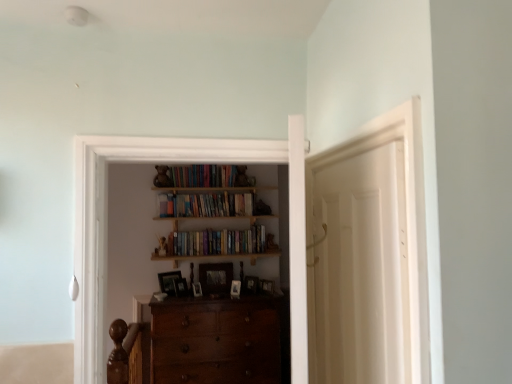
Describe the element at coordinates (267, 286) in the screenshot. The height and width of the screenshot is (384, 512). I see `wooden picture frame at center, acting as the 7th picture frame starting from the left` at that location.

In order to face wooden picture frame at center, which ranks as the first picture frame in right-to-left order, should I rotate leftwards or rightwards?

You should rotate right by 1.749 degrees.

Where is `wooden photo frame at center, the 7th picture frame from the right`? wooden photo frame at center, the 7th picture frame from the right is located at coordinates (169, 281).

This screenshot has height=384, width=512. Describe the element at coordinates (216, 278) in the screenshot. I see `wooden picture frame at center, which is counted as the fourth picture frame, starting from the right` at that location.

Measure the distance between point [239,288] and camera.

A distance of 3.75 meters exists between point [239,288] and camera.

The image size is (512, 384). Describe the element at coordinates (234, 289) in the screenshot. I see `wooden picture frame at center, the 3th picture frame positioned from the right` at that location.

The image size is (512, 384). I want to click on brown polished wood chair at lower left, so click(129, 353).

From the image's perspective, who appears lower, white matte door at center or brown polished wood chair at lower left?

brown polished wood chair at lower left, from the image's perspective.

Is white matte door at center smaller than brown polished wood chair at lower left?

Indeed, white matte door at center has a smaller size compared to brown polished wood chair at lower left.

In terms of width, does white matte door at center look wider or thinner when compared to brown polished wood chair at lower left?

white matte door at center is thinner than brown polished wood chair at lower left.

Which is less distant, (415, 252) or (138, 380)?

The point (415, 252) is in front.

Considering the positions of objects brown polished wood chair at lower left and wooden photo frame at center, placed as the second picture frame when sorted from left to right, in the image provided, who is more to the left, brown polished wood chair at lower left or wooden photo frame at center, placed as the second picture frame when sorted from left to right,?

brown polished wood chair at lower left is more to the left.

Which object is further away from the camera taking this photo, brown polished wood chair at lower left or wooden photo frame at center, placed as the sixth picture frame when sorted from right to left?

wooden photo frame at center, placed as the sixth picture frame when sorted from right to left, is more distant.

Considering the relative sizes of brown polished wood chair at lower left and wooden photo frame at center, placed as the sixth picture frame when sorted from right to left, in the image provided, is brown polished wood chair at lower left wider than wooden photo frame at center, placed as the sixth picture frame when sorted from right to left,?

Correct, the width of brown polished wood chair at lower left exceeds that of wooden photo frame at center, placed as the sixth picture frame when sorted from right to left.

Can you see wooden photo frame at center, which is the first picture frame in left-to-right order, touching wooden picture frame at center, which is counted as the sixth picture frame, starting from the left?

wooden photo frame at center, which is the first picture frame in left-to-right order, is not next to wooden picture frame at center, which is counted as the sixth picture frame, starting from the left, and they're not touching.

From the picture: Is wooden photo frame at center, the 7th picture frame from the right, bigger than wooden picture frame at center, the second picture frame positioned from the right?

Correct, wooden photo frame at center, the 7th picture frame from the right, is larger in size than wooden picture frame at center, the second picture frame positioned from the right.

Looking at this image, is wooden photo frame at center, which is the first picture frame in left-to-right order, shorter than wooden picture frame at center, the second picture frame positioned from the right?

No, wooden photo frame at center, which is the first picture frame in left-to-right order, is not shorter than wooden picture frame at center, the second picture frame positioned from the right.

Is wooden bookshelf at upper center, the first book from the top, oriented away from wooden photo frame at center, the third picture frame when ordered from left to right?

No, wooden photo frame at center, the third picture frame when ordered from left to right, is not at the back of wooden bookshelf at upper center, the first book from the top.

Considering the relative positions of wooden bookshelf at upper center, the first book from the top, and wooden photo frame at center, the third picture frame when ordered from left to right, in the image provided, is wooden bookshelf at upper center, the first book from the top, in front of wooden photo frame at center, the third picture frame when ordered from left to right,?

No, wooden bookshelf at upper center, the first book from the top, is further to the viewer.

Considering the sizes of objects wooden bookshelf at upper center, acting as the second book starting from the bottom, and wooden photo frame at center, the third picture frame when ordered from left to right, in the image provided, who is bigger, wooden bookshelf at upper center, acting as the second book starting from the bottom, or wooden photo frame at center, the third picture frame when ordered from left to right,?

wooden bookshelf at upper center, acting as the second book starting from the bottom.

From the image's perspective, between wooden bookshelf at upper center, acting as the second book starting from the bottom, and wooden photo frame at center, arranged as the fifth picture frame when viewed from the right, which one is located above?

wooden bookshelf at upper center, acting as the second book starting from the bottom, is shown above in the image.

Which point is more distant from viewer, (x=144, y=378) or (x=217, y=336)?

The point (x=144, y=378) is behind.

Is the position of brown polished wood chair at lower left less distant than that of shiny brown wooden chest of drawers at center?

Yes, it is in front of shiny brown wooden chest of drawers at center.

Does brown polished wood chair at lower left have a greater width compared to shiny brown wooden chest of drawers at center?

Incorrect, the width of brown polished wood chair at lower left does not surpass that of shiny brown wooden chest of drawers at center.

Is brown polished wood chair at lower left to the right of shiny brown wooden chest of drawers at center from the viewer's perspective?

No.

Is wooden picture frame at center, the second picture frame positioned from the right, oriented towards woodenmaterial/texture entertainment center at center?

No, wooden picture frame at center, the second picture frame positioned from the right, is not turned towards woodenmaterial/texture entertainment center at center.

Is the depth of wooden picture frame at center, which is counted as the sixth picture frame, starting from the left, greater than that of woodenmaterial/texture entertainment center at center?

Yes, it is behind woodenmaterial/texture entertainment center at center.

From the image's perspective, is wooden picture frame at center, which is counted as the sixth picture frame, starting from the left, located above or below woodenmaterial/texture entertainment center at center?

Clearly, from the image's perspective, wooden picture frame at center, which is counted as the sixth picture frame, starting from the left, is below woodenmaterial/texture entertainment center at center.

Considering the relative sizes of wooden picture frame at center, the second picture frame positioned from the right, and woodenmaterial/texture entertainment center at center in the image provided, is wooden picture frame at center, the second picture frame positioned from the right, thinner than woodenmaterial/texture entertainment center at center?

Yes, wooden picture frame at center, the second picture frame positioned from the right, is thinner than woodenmaterial/texture entertainment center at center.

Is shiny brown wooden chest of drawers at center aimed at hardcover books at center, which is the first book in bottom-to-top order?

No, shiny brown wooden chest of drawers at center is not aimed at hardcover books at center, which is the first book in bottom-to-top order.

Is shiny brown wooden chest of drawers at center located outside hardcover books at center, which is the first book in bottom-to-top order?

Yes, shiny brown wooden chest of drawers at center is located beyond the bounds of hardcover books at center, which is the first book in bottom-to-top order.

Is the position of shiny brown wooden chest of drawers at center less distant than that of hardcover books at center, which is counted as the second book, starting from the top?

Yes, shiny brown wooden chest of drawers at center is closer to the camera.

In the image, there is a white matte door at center. Where is `chair below it (from a real-world perspective)`? The height and width of the screenshot is (384, 512). chair below it (from a real-world perspective) is located at coordinates (129, 353).

Where is `the 2nd picture frame to the right of the brown polished wood chair at lower left, counting from the anchor's position`? the 2nd picture frame to the right of the brown polished wood chair at lower left, counting from the anchor's position is located at coordinates (180, 287).

Looking at the image, which one is located further to brown polished wood chair at lower left, wooden picture frame at center, marked as the fifth picture frame in a left-to-right arrangement, or wooden picture frame at center, the second picture frame positioned from the right?

wooden picture frame at center, the second picture frame positioned from the right, is positioned further to the anchor brown polished wood chair at lower left.

When comparing their distances from wooden photo frame at center, the third picture frame when ordered from left to right, does wooden picture frame at center, which is counted as the fourth picture frame, starting from the right, or wooden photo frame at center, placed as the second picture frame when sorted from left to right, seem closer?

wooden photo frame at center, placed as the second picture frame when sorted from left to right, is positioned closer to the anchor wooden photo frame at center, the third picture frame when ordered from left to right.

Looking at the image, which one is located closer to hardcover books at center, which is counted as the second book, starting from the top, white matte door at center or woodenmaterial/texture entertainment center at center?

The object closer to hardcover books at center, which is counted as the second book, starting from the top, is woodenmaterial/texture entertainment center at center.

From the image, which object appears to be farther from wooden photo frame at center, placed as the second picture frame when sorted from left to right, wooden picture frame at center, which ranks as the first picture frame in right-to-left order, or hardcover books at center, which is the first book in bottom-to-top order?

wooden picture frame at center, which ranks as the first picture frame in right-to-left order, is positioned further to the anchor wooden photo frame at center, placed as the second picture frame when sorted from left to right.

Considering their positions, is wooden photo frame at center, placed as the second picture frame when sorted from left to right, positioned further to woodenmaterial/texture entertainment center at center than wooden picture frame at center, marked as the fifth picture frame in a left-to-right arrangement?

wooden picture frame at center, marked as the fifth picture frame in a left-to-right arrangement.

Considering their positions, is hardcover books at center, which is counted as the second book, starting from the top, positioned further to wooden picture frame at center, marked as the fifth picture frame in a left-to-right arrangement, than wooden photo frame at center, arranged as the fifth picture frame when viewed from the right?

The object further to wooden picture frame at center, marked as the fifth picture frame in a left-to-right arrangement, is hardcover books at center, which is counted as the second book, starting from the top.

Considering their positions, is hardcover books at center, which is counted as the second book, starting from the top, positioned closer to wooden photo frame at center, the 7th picture frame from the right, than wooden picture frame at center, acting as the 7th picture frame starting from the left?

The object closer to wooden photo frame at center, the 7th picture frame from the right, is hardcover books at center, which is counted as the second book, starting from the top.

Looking at the image, which one is located closer to brown polished wood chair at lower left, wooden picture frame at center, the 3th picture frame positioned from the right, or wooden photo frame at center, which is the first picture frame in left-to-right order?

Based on the image, wooden photo frame at center, which is the first picture frame in left-to-right order, appears to be nearer to brown polished wood chair at lower left.

Locate an element on the screen. This screenshot has width=512, height=384. the chest of drawers located between wooden photo frame at center, the 7th picture frame from the right, and wooden picture frame at center, which is counted as the sixth picture frame, starting from the left, in the left-right direction is located at coordinates (216, 341).

The width and height of the screenshot is (512, 384). I want to click on chest of drawers between brown polished wood chair at lower left and wooden picture frame at center, placed as the 4th picture frame when sorted from left to right, along the z-axis, so click(x=216, y=341).

Identify the location of chair between white matte door at center and shiny brown wooden chest of drawers at center in the front-back direction. The width and height of the screenshot is (512, 384). (129, 353).

This screenshot has height=384, width=512. What are the coordinates of `entertainment center between white matte door at center and wooden photo frame at center, the 7th picture frame from the right, in the front-back direction` in the screenshot? It's located at (131, 239).